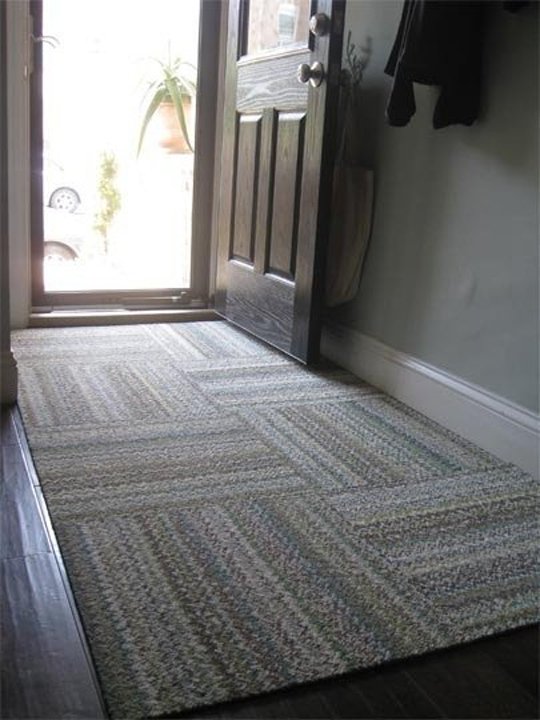
Locate an element on the screen. Image resolution: width=540 pixels, height=720 pixels. open door is located at coordinates (281, 318).